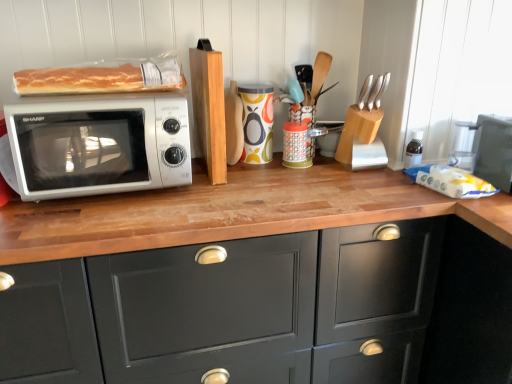
The height and width of the screenshot is (384, 512). Identify the location of free location in front of wooden knife block at upper right, the second appliance viewed from the right. (371, 183).